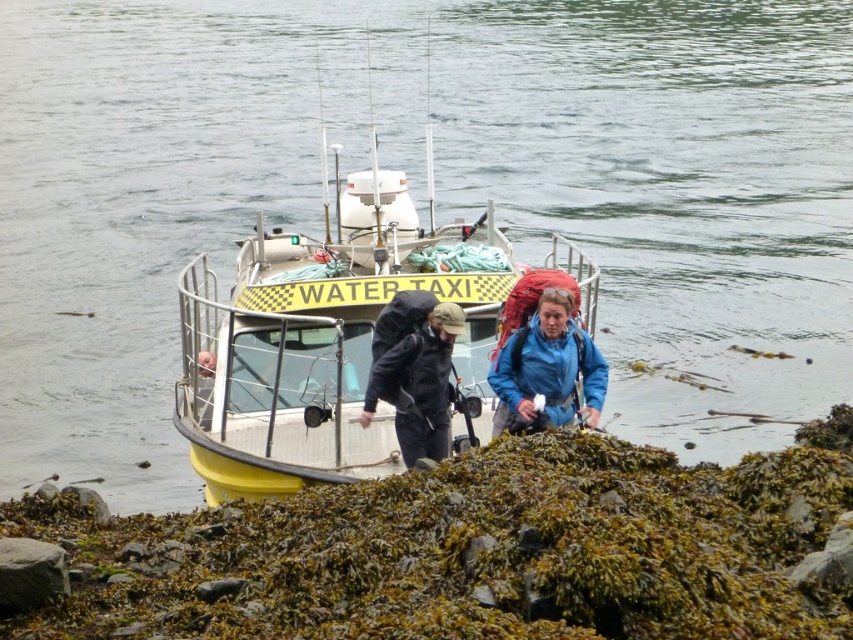
Question: Does black matte backpack at center have a greater width compared to blue fabric backpack at center?

Choices:
 (A) yes
 (B) no

Answer: (A)

Question: Which object is the closest to the green mossy algae at lower center?

Choices:
 (A) yellow matte water taxi at center
 (B) blue matte jacket at center
 (C) blue fabric backpack at center
 (D) black matte backpack at center

Answer: (D)

Question: In this image, where is green mossy algae at lower center located relative to black matte backpack at center?

Choices:
 (A) left
 (B) right

Answer: (B)

Question: Which point is closer to the camera taking this photo?

Choices:
 (A) (x=431, y=458)
 (B) (x=570, y=381)
 (C) (x=189, y=282)

Answer: (A)

Question: Is green mossy algae at lower center smaller than black matte backpack at center?

Choices:
 (A) yes
 (B) no

Answer: (B)

Question: Which of the following is the farthest from the observer?

Choices:
 (A) (550, 362)
 (B) (439, 333)

Answer: (A)